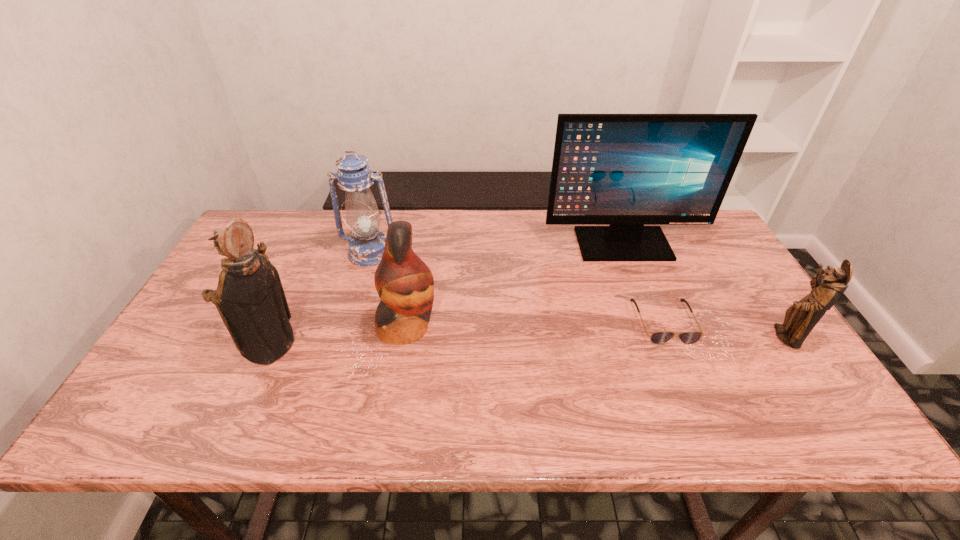
This screenshot has width=960, height=540. Identify the location of vacant point located between the left figurine and the right figurine. (528, 341).

At what (x,y) coordinates should I click in order to perform the action: click on free area in between the parrot and the taller figurine. Please return your answer as a coordinate pair (x, y). Looking at the image, I should click on (339, 336).

Identify the location of vacant space that is in between the shortest object and the leftmost object. (468, 333).

This screenshot has height=540, width=960. I want to click on vacant area that lies between the lantern and the shorter figurine, so click(x=578, y=294).

You are a GUI agent. You are given a task and a screenshot of the screen. Output one action in this format:
    pyautogui.click(x=<x>, y=<y>)
    Task: Click on the unoccupied position between the parrot and the shorter figurine
    Image resolution: width=960 pixels, height=540 pixels.
    Given the screenshot: What is the action you would take?
    pyautogui.click(x=596, y=332)

At what (x,y) coordinates should I click in order to perform the action: click on vacant area that lies between the lantern and the right figurine. Please return your answer as a coordinate pair (x, y). The image size is (960, 540). Looking at the image, I should click on (578, 294).

At what (x,y) coordinates should I click in order to perform the action: click on vacant region between the shortest object and the parrot. Please return your answer as a coordinate pair (x, y). The width and height of the screenshot is (960, 540). Looking at the image, I should click on (536, 324).

Image resolution: width=960 pixels, height=540 pixels. What are the coordinates of `object identified as the closest to the monitor` in the screenshot? It's located at (690, 337).

Where is `the closest object to the lantern`? This screenshot has width=960, height=540. the closest object to the lantern is located at coordinates (404, 283).

Where is `free point that satisfies the following two spatial constraints: 1. on the front-facing side of the shortest object; 2. on the face of the parrot`? free point that satisfies the following two spatial constraints: 1. on the front-facing side of the shortest object; 2. on the face of the parrot is located at coordinates (666, 327).